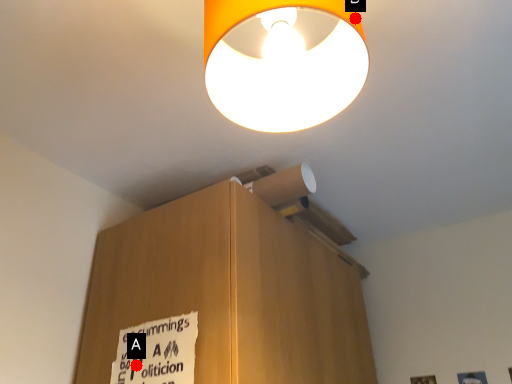
Question: Two points are circled on the image, labeled by A and B beside each circle. Which point is closer to the camera taking this photo?

Choices:
 (A) A is closer
 (B) B is closer

Answer: (B)